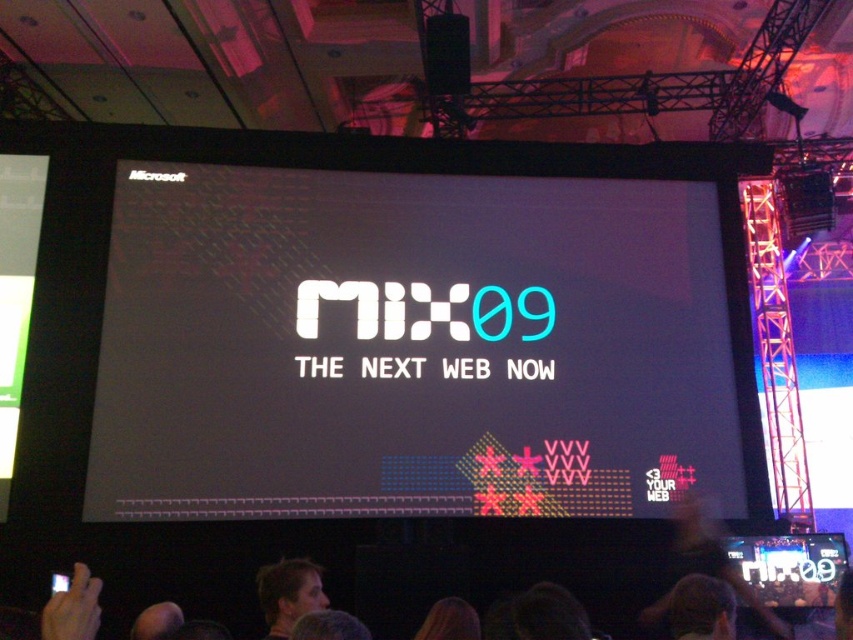
Question: Estimate the real-world distances between objects in this image. Which object is farther from the light brown hair at lower center?

Choices:
 (A) brown hair at lower center
 (B) white matte text at center

Answer: (B)

Question: Does white matte text at center lie in front of brown hair at lower center?

Choices:
 (A) no
 (B) yes

Answer: (A)

Question: Which object is positioned closest to the brown hair at lower center?

Choices:
 (A) light brown hair at lower center
 (B) white matte text at center
 (C) dark hair at lower center

Answer: (A)

Question: Does white matte text at center appear on the right side of light brown hair at lower center?

Choices:
 (A) no
 (B) yes

Answer: (B)

Question: Estimate the real-world distances between objects in this image. Which object is closer to the light brown hair at lower center?

Choices:
 (A) white matte text at center
 (B) dark hair at lower center

Answer: (B)

Question: Is light brown hair at lower center below brown hair at lower center?

Choices:
 (A) yes
 (B) no

Answer: (A)